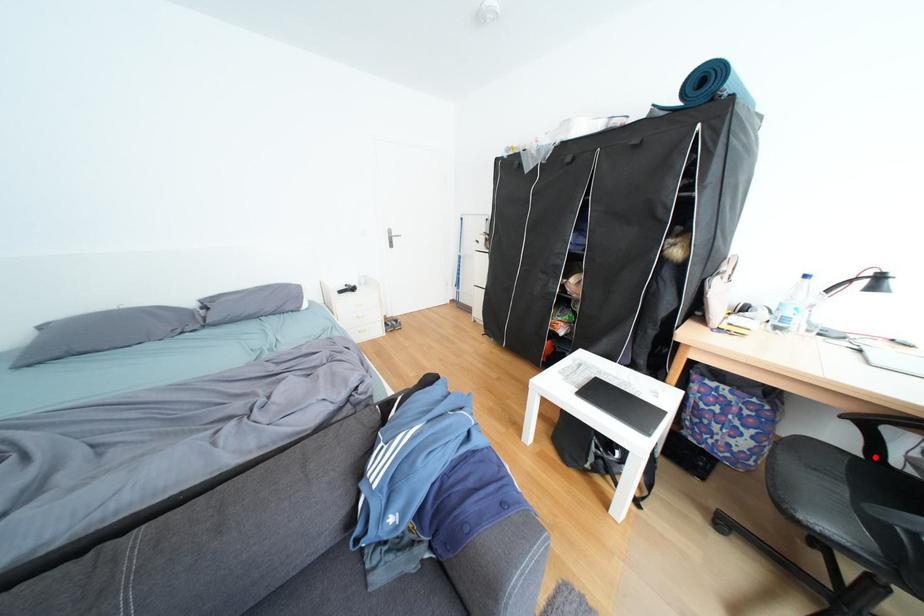
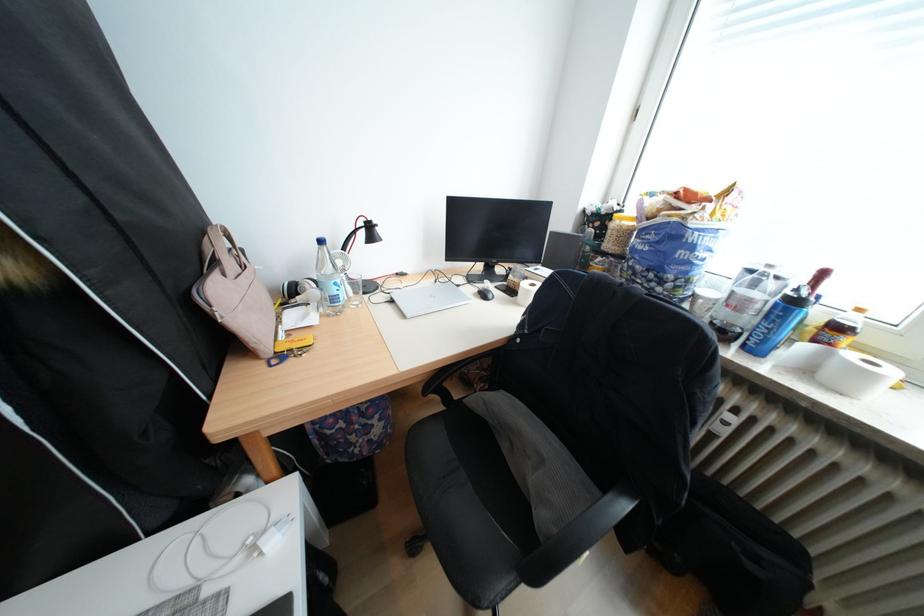
Question: I am providing you with two images of the same scene from different viewpoints. A red point is marked on the first image. Is the red point's position out of view in image 2?

Choices:
 (A) Yes
 (B) No

Answer: (B)